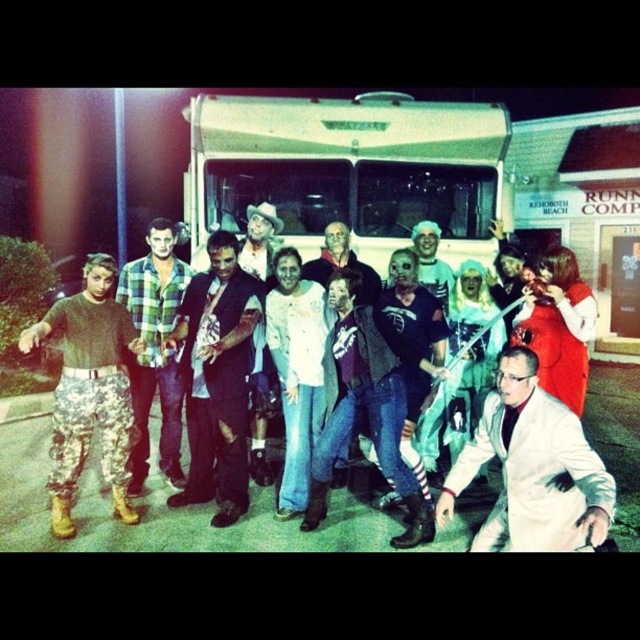
Can you confirm if ripped jeans at center is thinner than white shirt at center?

Incorrect, ripped jeans at center's width is not less than white shirt at center's.

How far apart are ripped jeans at center and white shirt at center?

ripped jeans at center is 1.33 meters from white shirt at center.

Is point (180, 493) less distant than point (333, 241)?

Yes, point (180, 493) is in front of point (333, 241).

This screenshot has height=640, width=640. Identify the location of ripped jeans at center. (218, 378).

Who is positioned more to the right, ripped jeans at center or camouflage pants at left?

From the viewer's perspective, ripped jeans at center appears more on the right side.

Can you confirm if ripped jeans at center is positioned below camouflage pants at left?

Incorrect, ripped jeans at center is not positioned below camouflage pants at left.

Who is more distant from viewer, (248, 288) or (124, 428)?

Point (248, 288)

Find the location of `ripped jeans at center`. ripped jeans at center is located at coordinates (218, 378).

Who is positioned more to the left, white glossy bus at center or ripped jeans at center?

Positioned to the left is ripped jeans at center.

Who is lower down, white glossy bus at center or ripped jeans at center?

Positioned lower is ripped jeans at center.

Which is in front, point (472, 150) or point (204, 292)?

Positioned in front is point (204, 292).

Locate an element on the screen. The height and width of the screenshot is (640, 640). white glossy bus at center is located at coordinates (346, 170).